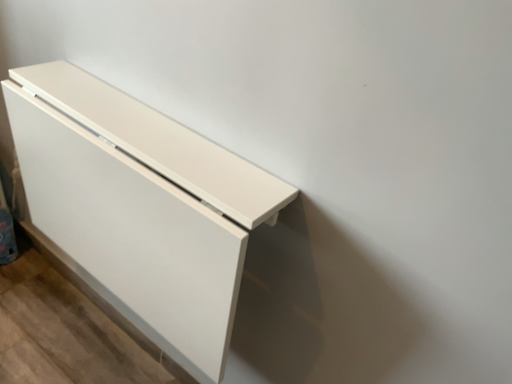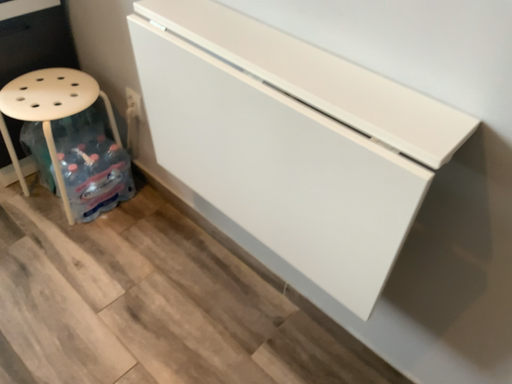
Question: Which way did the camera rotate in the video?

Choices:
 (A) rotated upward
 (B) rotated downward

Answer: (B)